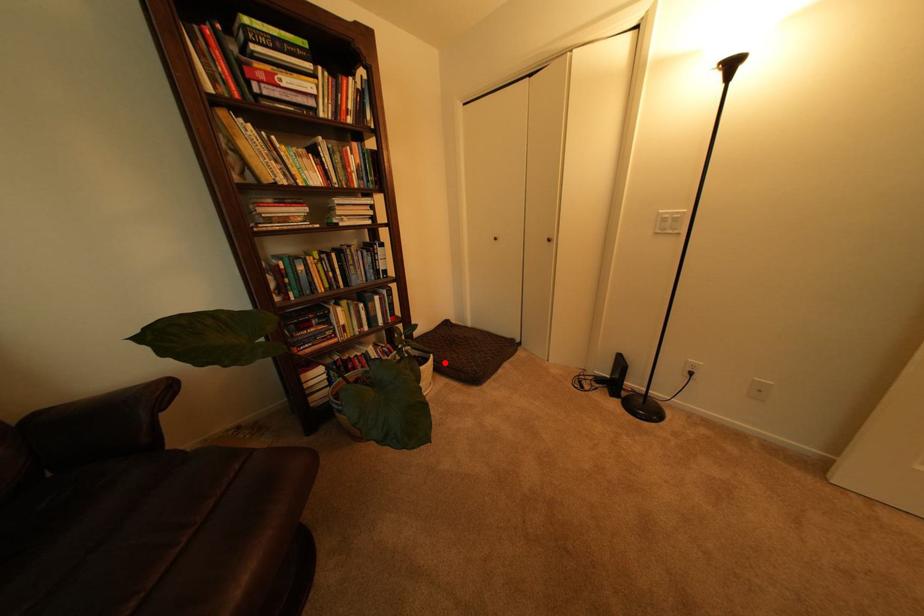
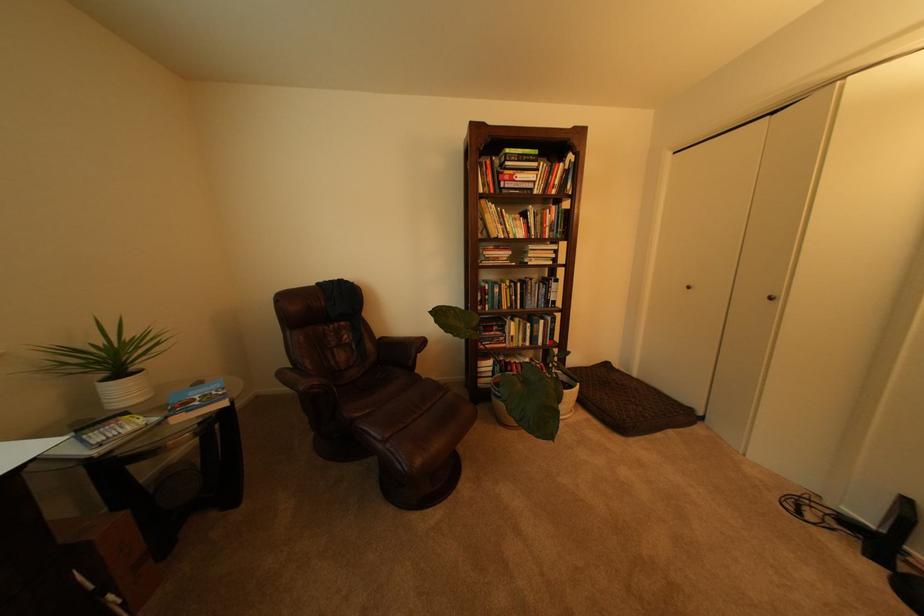
Question: A red point is marked in image1. In image2, is the corresponding 3D point closer to the camera or farther? Reply with the corresponding letter.

Choices:
 (A) The corresponding 3D point is closer.
 (B) The corresponding 3D point is farther.

Answer: (B)